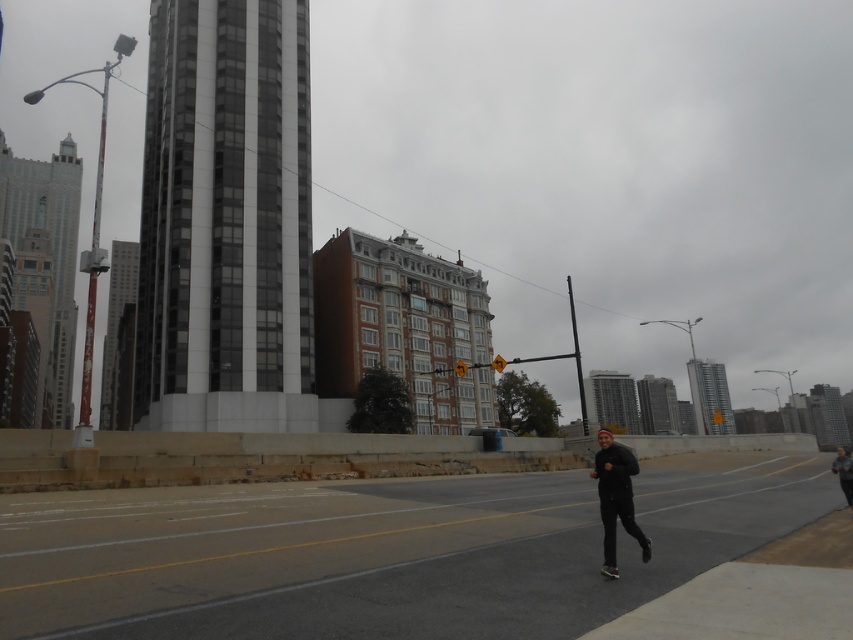
Between point (109, 253) and point (834, 444), which one is positioned behind?

Positioned behind is point (109, 253).

The image size is (853, 640). What do you see at coordinates (115, 317) in the screenshot?
I see `metallic silver tower at left` at bounding box center [115, 317].

Locate an element on the screen. The image size is (853, 640). metallic silver tower at left is located at coordinates (115, 317).

Looking at this image, who is shorter, black asphalt highway at center or metallic silver tower at left?

Standing shorter between the two is black asphalt highway at center.

Is point (589, 593) positioned in front of point (120, 316)?

Yes, point (589, 593) is closer to viewer.

Where is `black asphalt highway at center`? The image size is (853, 640). black asphalt highway at center is located at coordinates (381, 552).

Can you confirm if dark gray concrete building at upper right is smaller than multicolored rubber skateboard at lower right?

Actually, dark gray concrete building at upper right might be larger than multicolored rubber skateboard at lower right.

Can you confirm if dark gray concrete building at upper right is wider than multicolored rubber skateboard at lower right?

Yes.

Measure the distance between point (674, 424) and camera.

Point (674, 424) and camera are 188.03 meters apart.

You are a GUI agent. You are given a task and a screenshot of the screen. Output one action in this format:
    pyautogui.click(x=<x>, y=<y>)
    Task: Click on the dark gray concrete building at upper right
    The height and width of the screenshot is (640, 853).
    Given the screenshot: What is the action you would take?
    pyautogui.click(x=657, y=404)